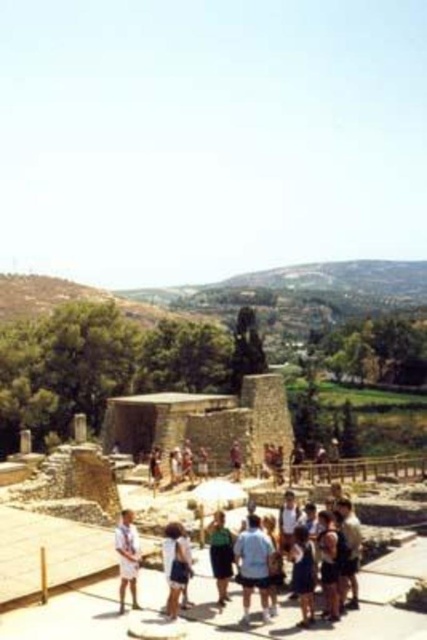
Question: Which object is the farthest from the white cotton shorts at lower center?

Choices:
 (A) green fabric dress at center
 (B) stone ruins at center

Answer: (B)

Question: Which of these objects is positioned farthest from the green fabric dress at center?

Choices:
 (A) white cotton shirt at center
 (B) light blue denim shorts at center
 (C) stone ruins at center
 (D) white cotton shorts at lower center

Answer: (C)

Question: Can you confirm if stone ruins at center is wider than white cotton shirt at center?

Choices:
 (A) yes
 (B) no

Answer: (A)

Question: Among these objects, which one is nearest to the camera?

Choices:
 (A) white cotton shorts at lower center
 (B) stone ruins at center
 (C) light blue denim shorts at center

Answer: (C)

Question: Is white cotton shorts at lower center smaller than green fabric dress at center?

Choices:
 (A) no
 (B) yes

Answer: (B)

Question: Does stone ruins at center have a lesser width compared to white cotton shorts at lower center?

Choices:
 (A) no
 (B) yes

Answer: (A)